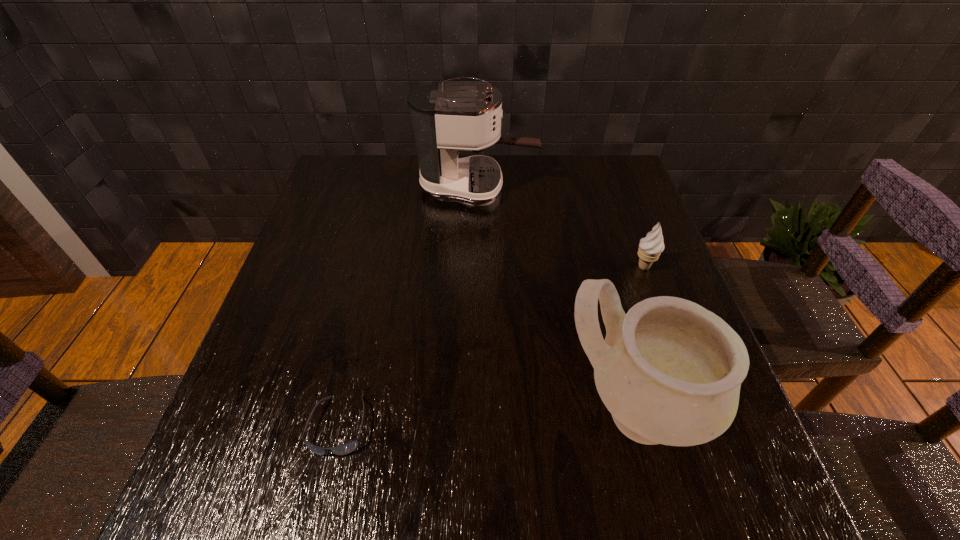
Where is `vacant space at the right edge`? This screenshot has width=960, height=540. vacant space at the right edge is located at coordinates (601, 228).

In order to click on free space at the far left corner of the desktop in this screenshot , I will do `click(324, 185)`.

Where is `free region at the far right corner of the desktop`? The width and height of the screenshot is (960, 540). free region at the far right corner of the desktop is located at coordinates (633, 195).

In order to click on vacant space in between the coffee maker and the second shortest object in this screenshot , I will do `click(561, 227)`.

The image size is (960, 540). I want to click on vacant space that's between the second shortest object and the coffee maker, so click(x=561, y=227).

The image size is (960, 540). Find the location of `free area in between the farthest object and the shortest object`. free area in between the farthest object and the shortest object is located at coordinates (408, 306).

This screenshot has width=960, height=540. In order to click on free space between the shortest object and the second shortest object in this screenshot , I will do `click(492, 346)`.

The height and width of the screenshot is (540, 960). Identify the location of vacant space in between the pottery and the leftmost object. (486, 418).

You are a GUI agent. You are given a task and a screenshot of the screen. Output one action in this format:
    pyautogui.click(x=<x>, y=<y>)
    Task: Click on the blank region between the pottery and the leftmost object
    Image resolution: width=960 pixels, height=540 pixels.
    Given the screenshot: What is the action you would take?
    pyautogui.click(x=486, y=418)

Identify the location of free space between the leftmost object and the icecream. (492, 346).